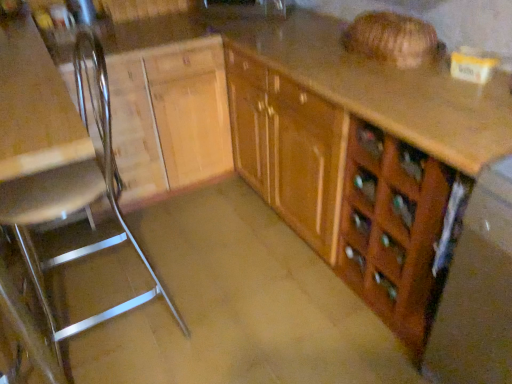
Question: Does wooden cabinet at center have a greater height compared to matte black sink at upper center?

Choices:
 (A) no
 (B) yes

Answer: (B)

Question: Could you tell me if wooden cabinet at center is turned towards matte black sink at upper center?

Choices:
 (A) yes
 (B) no

Answer: (B)

Question: Is wooden cabinet at center shorter than matte black sink at upper center?

Choices:
 (A) no
 (B) yes

Answer: (A)

Question: Considering the relative sizes of wooden cabinet at center and matte black sink at upper center in the image provided, is wooden cabinet at center thinner than matte black sink at upper center?

Choices:
 (A) no
 (B) yes

Answer: (A)

Question: Does wooden cabinet at center contain matte black sink at upper center?

Choices:
 (A) yes
 (B) no

Answer: (B)

Question: Is wooden cabinet at center facing away from matte black sink at upper center?

Choices:
 (A) yes
 (B) no

Answer: (B)

Question: From a real-world perspective, is metallic silver chair at left physically above brown matte concrete at center?

Choices:
 (A) no
 (B) yes

Answer: (B)

Question: From the image's perspective, is metallic silver chair at left on top of brown matte concrete at center?

Choices:
 (A) yes
 (B) no

Answer: (A)

Question: Is metallic silver chair at left taller than brown matte concrete at center?

Choices:
 (A) no
 (B) yes

Answer: (B)

Question: From a real-world perspective, does metallic silver chair at left sit lower than brown matte concrete at center?

Choices:
 (A) yes
 (B) no

Answer: (B)

Question: Considering the relative sizes of metallic silver chair at left and brown matte concrete at center in the image provided, is metallic silver chair at left bigger than brown matte concrete at center?

Choices:
 (A) no
 (B) yes

Answer: (B)

Question: From the image's perspective, does metallic silver chair at left appear lower than brown matte concrete at center?

Choices:
 (A) no
 (B) yes

Answer: (A)

Question: Is metallic silver chair at left looking in the opposite direction of wooden cabinet at center?

Choices:
 (A) yes
 (B) no

Answer: (A)